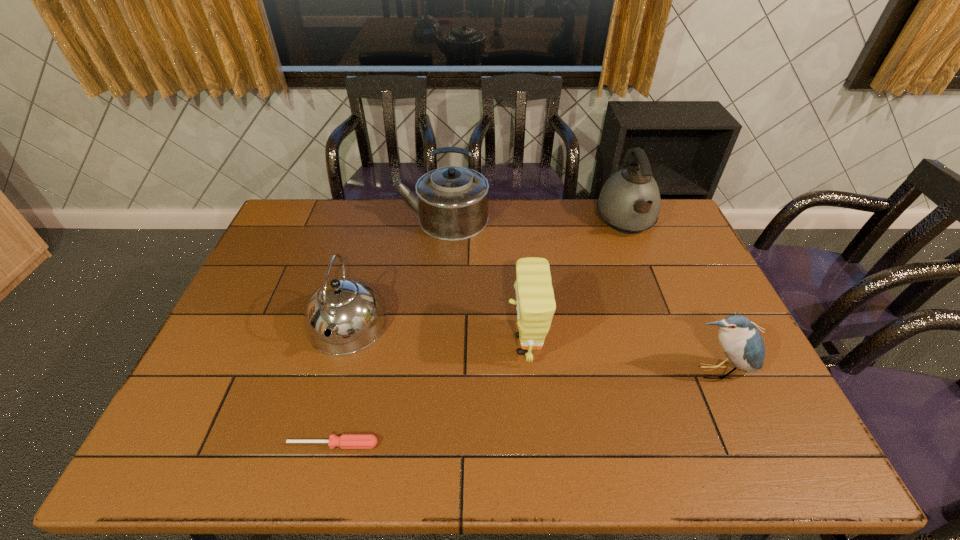
I want to click on free location at the far left corner of the desktop, so click(x=300, y=232).

In the image, there is a desktop. At what (x,y) coordinates should I click in order to perform the action: click on vacant space at the near left corner. Please return your answer as a coordinate pair (x, y). The width and height of the screenshot is (960, 540). Looking at the image, I should click on (185, 434).

You are a GUI agent. You are given a task and a screenshot of the screen. Output one action in this format:
    pyautogui.click(x=<x>, y=<y>)
    Task: Click on the blank space at the near right corner of the desktop
    The width and height of the screenshot is (960, 540).
    Given the screenshot: What is the action you would take?
    pyautogui.click(x=790, y=435)

Where is `free space that is in between the sponge and the bird`? This screenshot has width=960, height=540. free space that is in between the sponge and the bird is located at coordinates (620, 359).

Where is `vacant space that is in between the screwdriver and the rightmost kettle`? This screenshot has height=540, width=960. vacant space that is in between the screwdriver and the rightmost kettle is located at coordinates (480, 333).

Where is `free point between the bird and the fourth object from left to right`? Image resolution: width=960 pixels, height=540 pixels. free point between the bird and the fourth object from left to right is located at coordinates (620, 359).

I want to click on free space that is in between the bird and the screwdriver, so pyautogui.click(x=524, y=408).

Locate an element on the screen. free space between the screwdriver and the bird is located at coordinates (524, 408).

The width and height of the screenshot is (960, 540). In order to click on free spot between the nearest kettle and the fourth object from left to right in this screenshot , I will do `click(436, 335)`.

Where is `free space between the bird and the nearest object`? This screenshot has height=540, width=960. free space between the bird and the nearest object is located at coordinates (524, 408).